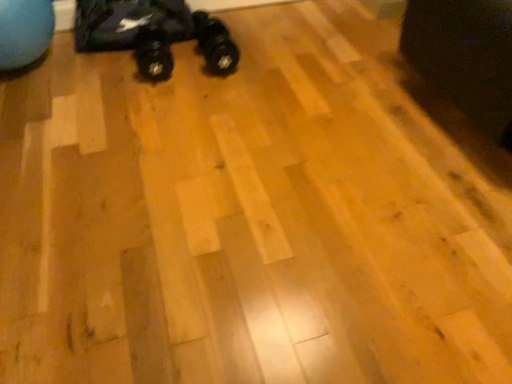
Question: Does black rubber shoe at center touch black rubber toy car at upper left?

Choices:
 (A) no
 (B) yes

Answer: (A)

Question: Is black rubber shoe at center surrounding black rubber toy car at upper left?

Choices:
 (A) yes
 (B) no

Answer: (B)

Question: Considering the relative sizes of black rubber shoe at center and black rubber toy car at upper left in the image provided, is black rubber shoe at center taller than black rubber toy car at upper left?

Choices:
 (A) yes
 (B) no

Answer: (B)

Question: From a real-world perspective, is black rubber shoe at center physically above black rubber toy car at upper left?

Choices:
 (A) yes
 (B) no

Answer: (B)

Question: Considering the relative sizes of black rubber shoe at center and black rubber toy car at upper left in the image provided, is black rubber shoe at center smaller than black rubber toy car at upper left?

Choices:
 (A) no
 (B) yes

Answer: (B)

Question: Is point (496, 54) closer or farther from the camera than point (169, 64)?

Choices:
 (A) farther
 (B) closer

Answer: (B)

Question: From the image's perspective, is black fabric swivel chair at upper right positioned above or below black rubber toy car at upper left?

Choices:
 (A) below
 (B) above

Answer: (A)

Question: Is black fabric swivel chair at upper right wider or thinner than black rubber toy car at upper left?

Choices:
 (A) wide
 (B) thin

Answer: (A)

Question: In terms of height, does black fabric swivel chair at upper right look taller or shorter compared to black rubber toy car at upper left?

Choices:
 (A) short
 (B) tall

Answer: (B)

Question: Is black rubber shoe at center inside or outside of black rubber toy car at upper left?

Choices:
 (A) outside
 (B) inside

Answer: (A)

Question: From a real-world perspective, is black rubber shoe at center above or below black rubber toy car at upper left?

Choices:
 (A) above
 (B) below

Answer: (B)

Question: Is point (198, 44) closer or farther from the camera than point (225, 66)?

Choices:
 (A) closer
 (B) farther

Answer: (B)

Question: Looking at the image, does black rubber shoe at center seem bigger or smaller compared to black rubber toy car at upper left?

Choices:
 (A) small
 (B) big

Answer: (A)

Question: Considering the positions of black rubber shoe at center and black fabric swivel chair at upper right in the image, is black rubber shoe at center wider or thinner than black fabric swivel chair at upper right?

Choices:
 (A) thin
 (B) wide

Answer: (A)

Question: In terms of size, does black rubber shoe at center appear bigger or smaller than black fabric swivel chair at upper right?

Choices:
 (A) small
 (B) big

Answer: (A)